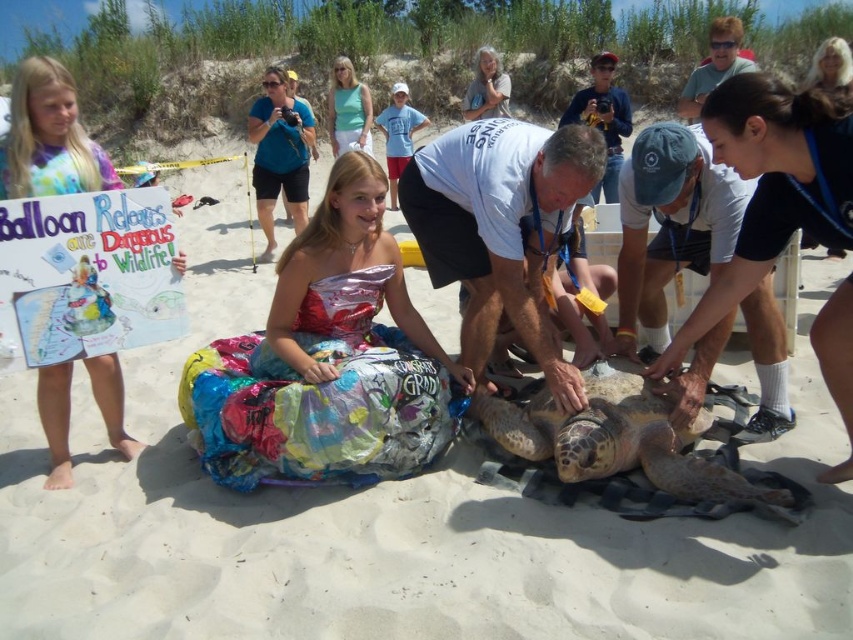
Question: Which object appears closest to the camera in this image?

Choices:
 (A) green cotton shirt at upper center
 (B) leathery brown turtle at center
 (C) blue fabric camera at upper center
 (D) pastel tie-dye shirt at left

Answer: (B)

Question: Which object appears closest to the camera in this image?

Choices:
 (A) pastel tie-dye shirt at left
 (B) leathery brown turtle at center
 (C) green cotton shirt at upper center
 (D) blue fabric camera at upper center

Answer: (B)

Question: Is leathery brown turtle at center above pastel tie-dye shirt at left?

Choices:
 (A) no
 (B) yes

Answer: (A)

Question: Does leathery brown turtle at center appear on the right side of pastel tie-dye shirt at left?

Choices:
 (A) yes
 (B) no

Answer: (A)

Question: Which object is closer to the camera taking this photo?

Choices:
 (A) blue fabric camera at upper center
 (B) leathery brown turtle at center
 (C) pastel tie-dye shirt at left
 (D) green cotton shirt at upper center

Answer: (B)

Question: Does pastel tie-dye shirt at left have a larger size compared to blue fabric camera at upper center?

Choices:
 (A) yes
 (B) no

Answer: (B)